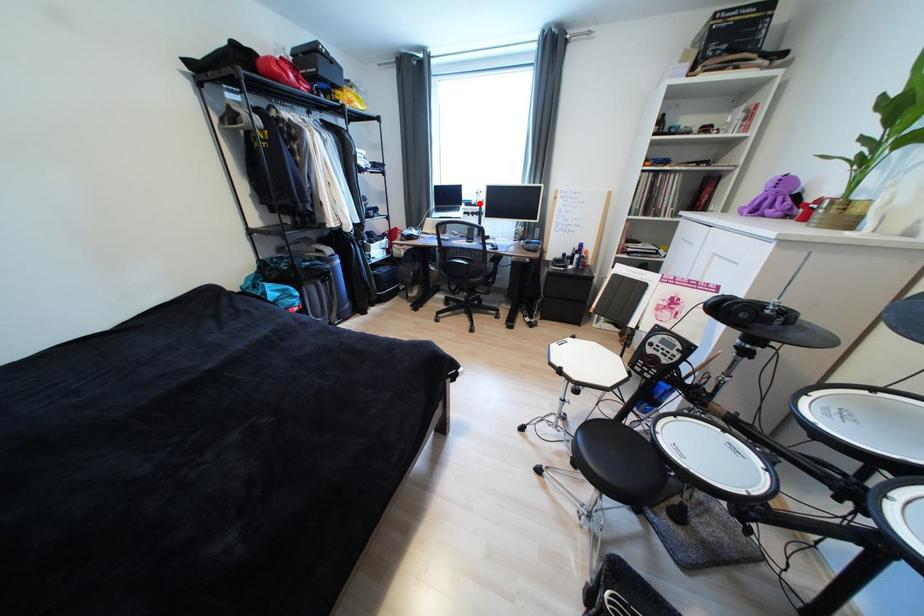
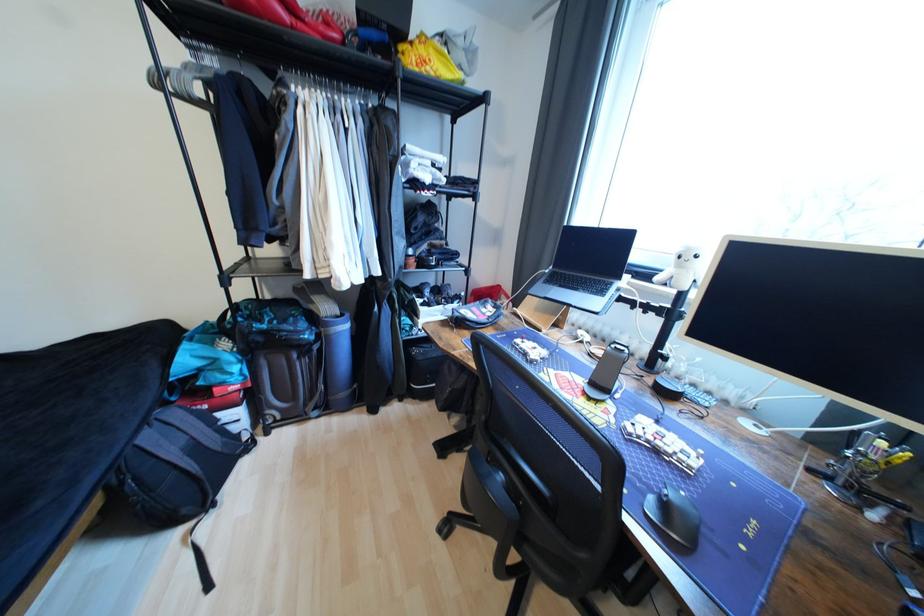
Find the pixel in the second image that matches the highlighted location in the first image.

(663, 280)